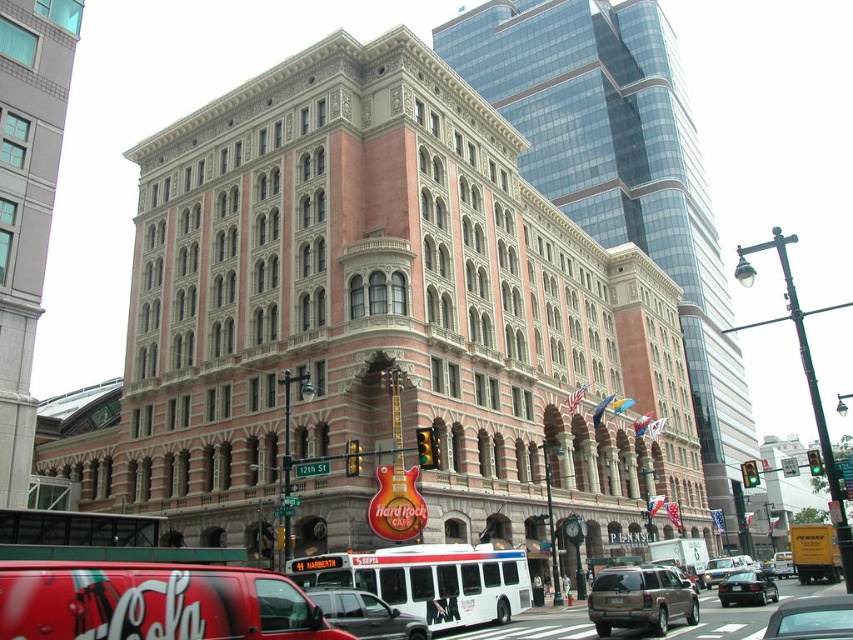
Question: Which point appears closest to the camera in this image?

Choices:
 (A) (326, 586)
 (B) (689, 618)
 (C) (802, 604)

Answer: (C)

Question: Can you confirm if metallic silver suv at center is positioned below shiny black sedan at center?

Choices:
 (A) yes
 (B) no

Answer: (B)

Question: Does white matte bus at center appear on the right side of metallic silver suv at center?

Choices:
 (A) no
 (B) yes

Answer: (B)

Question: Among these objects, which one is farthest from the camera?

Choices:
 (A) metallic silver suv at center
 (B) metallic gray car at center
 (C) shiny black sedan at center
 (D) metallic brown suv at center

Answer: (C)

Question: Does white matte bus at center have a smaller size compared to shiny black sedan at center?

Choices:
 (A) no
 (B) yes

Answer: (B)

Question: Which of the following is the farthest from the observer?

Choices:
 (A) (636, 616)
 (B) (457, 593)
 (C) (770, 596)

Answer: (C)